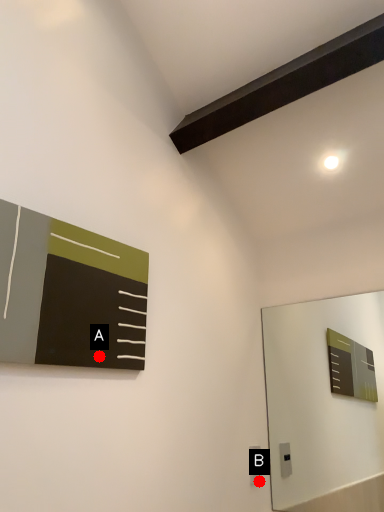
Question: Two points are circled on the image, labeled by A and B beside each circle. Which point appears farthest from the camera in this image?

Choices:
 (A) A is further
 (B) B is further

Answer: (B)